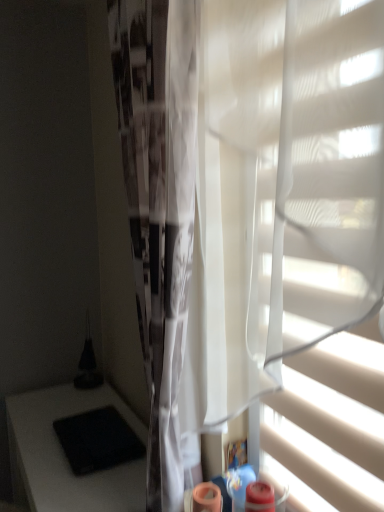
Question: Considering the positions of point (142, 34) and point (74, 488), is point (142, 34) closer or farther from the camera than point (74, 488)?

Choices:
 (A) farther
 (B) closer

Answer: (B)

Question: In the image, is white sheer fabric at center positioned in front of or behind black matte table at lower left?

Choices:
 (A) front
 (B) behind

Answer: (A)

Question: Estimate the real-world distances between objects in this image. Which object is farther from the white sheer fabric at center?

Choices:
 (A) black matte table at lower left
 (B) white matte blind at right
 (C) black matte pad at lower left

Answer: (A)

Question: Which of these objects is positioned closest to the black matte table at lower left?

Choices:
 (A) white matte blind at right
 (B) black matte pad at lower left
 (C) white sheer fabric at center

Answer: (B)